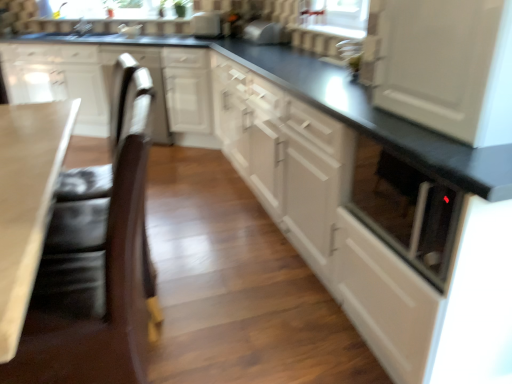
You are a GUI agent. You are given a task and a screenshot of the screen. Output one action in this format:
    pyautogui.click(x=<x>, y=<y>)
    Task: Click on the brown leather swivel chair at left, the 1th swivel chair viewed from the front
    The image size is (512, 384).
    Given the screenshot: What is the action you would take?
    pyautogui.click(x=93, y=297)

What do you see at coordinates (93, 297) in the screenshot?
I see `brown leather swivel chair at left, the 1th swivel chair viewed from the front` at bounding box center [93, 297].

What is the approximate height of white glossy toaster at upper center, which is counted as the first appliance, starting from the back?

8.04 inches.

Describe the element at coordinates (118, 8) in the screenshot. I see `matte white vase at upper center` at that location.

In order to face satin silver toaster at upper center, arranged as the 1th appliance when viewed from the right, should I rotate leftwards or rightwards?

Turn right by 1.141 degrees to look at satin silver toaster at upper center, arranged as the 1th appliance when viewed from the right.

Image resolution: width=512 pixels, height=384 pixels. What do you see at coordinates (58, 80) in the screenshot? I see `white glossy cabinet at upper left, acting as the 2th cabinetry starting from the left` at bounding box center [58, 80].

How much space does white glossy cabinet at center, the 3th cabinetry in the left-to-right sequence, occupy vertically?

white glossy cabinet at center, the 3th cabinetry in the left-to-right sequence, is 36.11 inches in height.

Where is `brown leather swivel chair at left, which is counted as the second swivel chair, starting from the back`? brown leather swivel chair at left, which is counted as the second swivel chair, starting from the back is located at coordinates (93, 297).

Is white glossy cabinet at center, the 3th cabinetry in the left-to-right sequence, oriented away from white glossy cabinet at center, the first cabinetry in the right-to-left sequence?

white glossy cabinet at center, the 3th cabinetry in the left-to-right sequence, is not turned away from white glossy cabinet at center, the first cabinetry in the right-to-left sequence.

Which of these two, white glossy cabinet at center, which is the second cabinetry in right-to-left order, or white glossy cabinet at center, the fourth cabinetry from the left, is bigger?

white glossy cabinet at center, which is the second cabinetry in right-to-left order, is bigger.

From a real-world perspective, is white glossy cabinet at center, the 3th cabinetry in the left-to-right sequence, located higher than white glossy cabinet at center, the first cabinetry in the right-to-left sequence?

No, from a real-world perspective, white glossy cabinet at center, the 3th cabinetry in the left-to-right sequence, is not above white glossy cabinet at center, the first cabinetry in the right-to-left sequence.

Where is `swivel chair that appears above the smooth beige countertop at lower left (from the image's perspective)`? swivel chair that appears above the smooth beige countertop at lower left (from the image's perspective) is located at coordinates (101, 210).

Considering the relative sizes of smooth beige countertop at lower left and black leather swivel chair at left, which appears as the 1th swivel chair when viewed from the back, in the image provided, is smooth beige countertop at lower left smaller than black leather swivel chair at left, which appears as the 1th swivel chair when viewed from the back,?

Incorrect, smooth beige countertop at lower left is not smaller in size than black leather swivel chair at left, which appears as the 1th swivel chair when viewed from the back.

From the image's perspective, is smooth beige countertop at lower left located above or below black leather swivel chair at left, marked as the second swivel chair in a front-to-back arrangement?

Based on their image positions, smooth beige countertop at lower left is located beneath black leather swivel chair at left, marked as the second swivel chair in a front-to-back arrangement.

Can black leather swivel chair at left, marked as the second swivel chair in a front-to-back arrangement, be found inside smooth beige countertop at lower left?

Yes, smooth beige countertop at lower left is surrounding black leather swivel chair at left, marked as the second swivel chair in a front-to-back arrangement.

From a real-world perspective, is white glossy cabinet at left, which ranks as the 1th cabinetry in left-to-right order, physically located above or below white glossy cabinet at center, which is the second cabinetry in right-to-left order?

white glossy cabinet at left, which ranks as the 1th cabinetry in left-to-right order, is situated higher than white glossy cabinet at center, which is the second cabinetry in right-to-left order, in the real world.

Would you say white glossy cabinet at left, which ranks as the 1th cabinetry in left-to-right order, contains white glossy cabinet at center, the 3th cabinetry in the left-to-right sequence?

No, white glossy cabinet at center, the 3th cabinetry in the left-to-right sequence, is located outside of white glossy cabinet at left, which ranks as the 1th cabinetry in left-to-right order.

Is white glossy cabinet at left, the 4th cabinetry from the right, not near white glossy cabinet at center, which is the second cabinetry in right-to-left order?

white glossy cabinet at left, the 4th cabinetry from the right, is actually quite close to white glossy cabinet at center, which is the second cabinetry in right-to-left order.

Does white glossy cabinet at center, the first cabinetry in the right-to-left sequence, come behind satin silver toaster at upper center, placed as the 1th appliance when sorted from front to back?

Yes, white glossy cabinet at center, the first cabinetry in the right-to-left sequence, is behind satin silver toaster at upper center, placed as the 1th appliance when sorted from front to back.

Is white glossy cabinet at center, the fourth cabinetry from the left, smaller than satin silver toaster at upper center, placed as the 1th appliance when sorted from front to back?

Actually, white glossy cabinet at center, the fourth cabinetry from the left, might be larger than satin silver toaster at upper center, placed as the 1th appliance when sorted from front to back.

Is white glossy cabinet at center, the first cabinetry in the right-to-left sequence, thinner than satin silver toaster at upper center, placed as the 2th appliance when sorted from back to front?

No.

Does smooth beige countertop at lower left have a lesser height compared to white glossy cabinet at center, the 3th cabinetry in the left-to-right sequence?

Indeed, smooth beige countertop at lower left has a lesser height compared to white glossy cabinet at center, the 3th cabinetry in the left-to-right sequence.

How much distance is there between smooth beige countertop at lower left and white glossy cabinet at center, which is the second cabinetry in right-to-left order?

A distance of 1.76 meters exists between smooth beige countertop at lower left and white glossy cabinet at center, which is the second cabinetry in right-to-left order.

Is smooth beige countertop at lower left to the left of white glossy cabinet at center, which is the second cabinetry in right-to-left order, from the viewer's perspective?

Yes.

Does point (17, 247) come in front of point (105, 55)?

Yes, point (17, 247) is closer to viewer.

Consider the image. Is satin silver toaster at upper center, placed as the 1th appliance when sorted from front to back, not within black leather swivel chair at left, marked as the second swivel chair in a front-to-back arrangement?

Absolutely, satin silver toaster at upper center, placed as the 1th appliance when sorted from front to back, is external to black leather swivel chair at left, marked as the second swivel chair in a front-to-back arrangement.

How different are the orientations of satin silver toaster at upper center, arranged as the 1th appliance when viewed from the right, and black leather swivel chair at left, marked as the second swivel chair in a front-to-back arrangement, in degrees?

The facing directions of satin silver toaster at upper center, arranged as the 1th appliance when viewed from the right, and black leather swivel chair at left, marked as the second swivel chair in a front-to-back arrangement, are 3.24 degrees apart.

Is satin silver toaster at upper center, arranged as the 1th appliance when viewed from the right, facing away from black leather swivel chair at left, which appears as the 1th swivel chair when viewed from the back?

No, satin silver toaster at upper center, arranged as the 1th appliance when viewed from the right,'s orientation is not away from black leather swivel chair at left, which appears as the 1th swivel chair when viewed from the back.

Which object is wider, satin silver toaster at upper center, which ranks as the 2th appliance in left-to-right order, or black leather swivel chair at left, marked as the second swivel chair in a front-to-back arrangement?

Wider between the two is black leather swivel chair at left, marked as the second swivel chair in a front-to-back arrangement.

Looking at this image, relative to white glossy toaster at upper center, which appears as the second appliance when viewed from the right, is white glossy cabinet at center, which is the second cabinetry in right-to-left order, in front or behind?

white glossy cabinet at center, which is the second cabinetry in right-to-left order, is in front of white glossy toaster at upper center, which appears as the second appliance when viewed from the right.

Looking at their sizes, would you say white glossy cabinet at center, the 3th cabinetry in the left-to-right sequence, is wider or thinner than white glossy toaster at upper center, which ranks as the second appliance in front-to-back order?

Clearly, white glossy cabinet at center, the 3th cabinetry in the left-to-right sequence, has more width compared to white glossy toaster at upper center, which ranks as the second appliance in front-to-back order.

Which object is positioned more to the right, white glossy cabinet at center, which is the second cabinetry in right-to-left order, or white glossy toaster at upper center, placed as the first appliance when sorted from left to right?

white glossy toaster at upper center, placed as the first appliance when sorted from left to right, is more to the right.

Considering the relative sizes of white glossy cabinet at center, the 3th cabinetry in the left-to-right sequence, and white glossy toaster at upper center, which ranks as the second appliance in front-to-back order, in the image provided, is white glossy cabinet at center, the 3th cabinetry in the left-to-right sequence, shorter than white glossy toaster at upper center, which ranks as the second appliance in front-to-back order,?

No.

Which cabinetry is the 1st one when counting from the left side of the white glossy cabinet at center, the first cabinetry in the right-to-left sequence? Please provide its 2D coordinates.

[(152, 79)]

Which swivel chair is the 1st one when counting from the right side of the smooth beige countertop at lower left? Please provide its 2D coordinates.

[(101, 210)]

Estimate the real-world distances between objects in this image. Which object is further from matte white vase at upper center, white glossy cabinet at center, the 3th cabinetry in the left-to-right sequence, or white glossy cabinet at upper left, acting as the 2th cabinetry starting from the left?

The object further to matte white vase at upper center is white glossy cabinet at center, the 3th cabinetry in the left-to-right sequence.

Estimate the real-world distances between objects in this image. Which object is closer to matte white vase at upper center, black leather swivel chair at left, which appears as the 1th swivel chair when viewed from the back, or satin silver toaster at upper center, which ranks as the 2th appliance in left-to-right order?

satin silver toaster at upper center, which ranks as the 2th appliance in left-to-right order, lies closer to matte white vase at upper center than the other object.

Which object lies further to the anchor point white glossy cabinet at center, which is the second cabinetry in right-to-left order, satin silver toaster at upper center, placed as the 2th appliance when sorted from back to front, or matte white vase at upper center?

Based on the image, satin silver toaster at upper center, placed as the 2th appliance when sorted from back to front, appears to be further to white glossy cabinet at center, which is the second cabinetry in right-to-left order.

Looking at the image, which one is located further to white glossy toaster at upper center, which is counted as the first appliance, starting from the back, black leather swivel chair at left, marked as the second swivel chair in a front-to-back arrangement, or white glossy cabinet at center, which is the second cabinetry in right-to-left order?

The object further to white glossy toaster at upper center, which is counted as the first appliance, starting from the back, is black leather swivel chair at left, marked as the second swivel chair in a front-to-back arrangement.

Based on their spatial positions, is smooth beige countertop at lower left or white glossy cabinet at left, which ranks as the 1th cabinetry in left-to-right order, further from satin silver toaster at upper center, placed as the 1th appliance when sorted from front to back?

Among the two, smooth beige countertop at lower left is located further to satin silver toaster at upper center, placed as the 1th appliance when sorted from front to back.

Estimate the real-world distances between objects in this image. Which object is further from smooth beige countertop at lower left, white glossy cabinet at center, the 3th cabinetry in the left-to-right sequence, or satin silver toaster at upper center, placed as the 1th appliance when sorted from front to back?

satin silver toaster at upper center, placed as the 1th appliance when sorted from front to back, lies further to smooth beige countertop at lower left than the other object.

Looking at the image, which one is located closer to brown leather swivel chair at left, which is counted as the second swivel chair, starting from the back, matte white vase at upper center or smooth beige countertop at lower left?

Based on the image, smooth beige countertop at lower left appears to be nearer to brown leather swivel chair at left, which is counted as the second swivel chair, starting from the back.

From the image, which object appears to be nearer to white glossy cabinet at center, the 3th cabinetry in the left-to-right sequence, satin silver toaster at upper center, arranged as the 1th appliance when viewed from the right, or white glossy cabinet at center, the fourth cabinetry from the left?

white glossy cabinet at center, the fourth cabinetry from the left, is closer to white glossy cabinet at center, the 3th cabinetry in the left-to-right sequence.

Image resolution: width=512 pixels, height=384 pixels. I want to click on appliance between white glossy cabinet at center, the 3th cabinetry in the left-to-right sequence, and satin silver toaster at upper center, placed as the 1th appliance when sorted from front to back, from left to right, so click(x=206, y=25).

Find the location of a particular element. The image size is (512, 384). swivel chair between brown leather swivel chair at left, which is counted as the second swivel chair, starting from the back, and white glossy cabinet at upper left, marked as the third cabinetry in a right-to-left arrangement, from front to back is located at coordinates (101, 210).

Find the location of a particular element. This screenshot has width=512, height=384. cabinetry positioned between smooth beige countertop at lower left and satin silver toaster at upper center, placed as the 2th appliance when sorted from back to front, from near to far is located at coordinates (110, 84).

Locate an element on the screen. Image resolution: width=512 pixels, height=384 pixels. cabinetry between brown leather swivel chair at left, which is counted as the second swivel chair, starting from the back, and satin silver toaster at upper center, placed as the 2th appliance when sorted from back to front, along the z-axis is located at coordinates (110, 84).